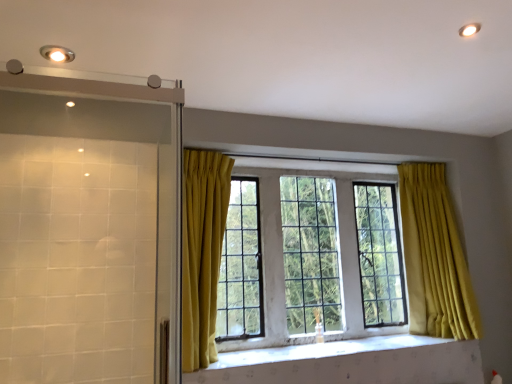
This screenshot has height=384, width=512. What are the coordinates of `free spot to the right of white glossy light fixture at upper right` in the screenshot? It's located at [x=497, y=34].